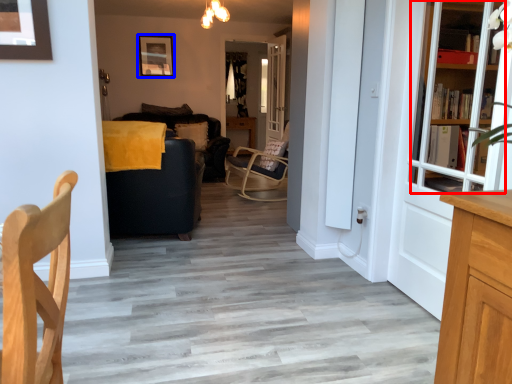
Question: Which object is closer to the camera taking this photo, bookcase (highlighted by a red box) or picture frame (highlighted by a blue box)?

Choices:
 (A) bookcase
 (B) picture frame

Answer: (A)